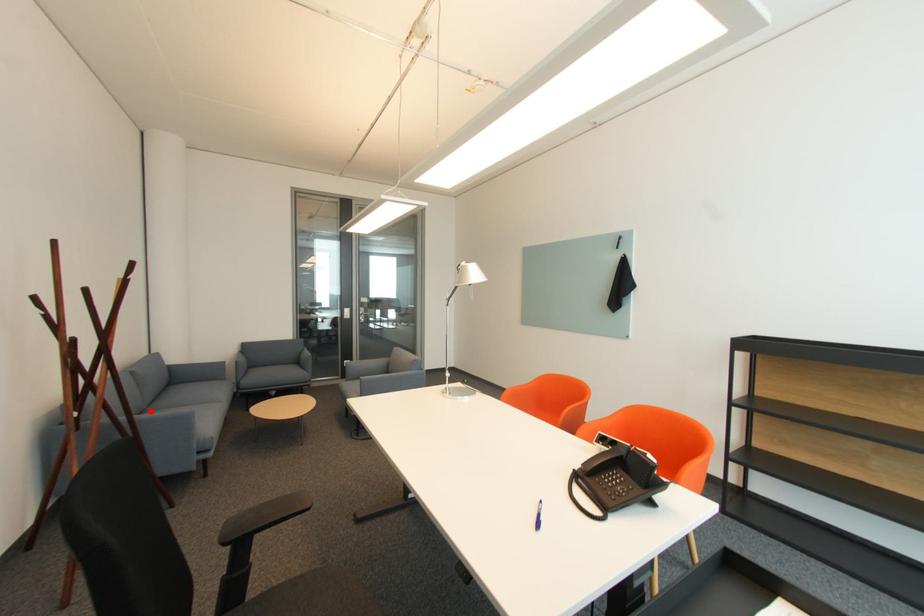
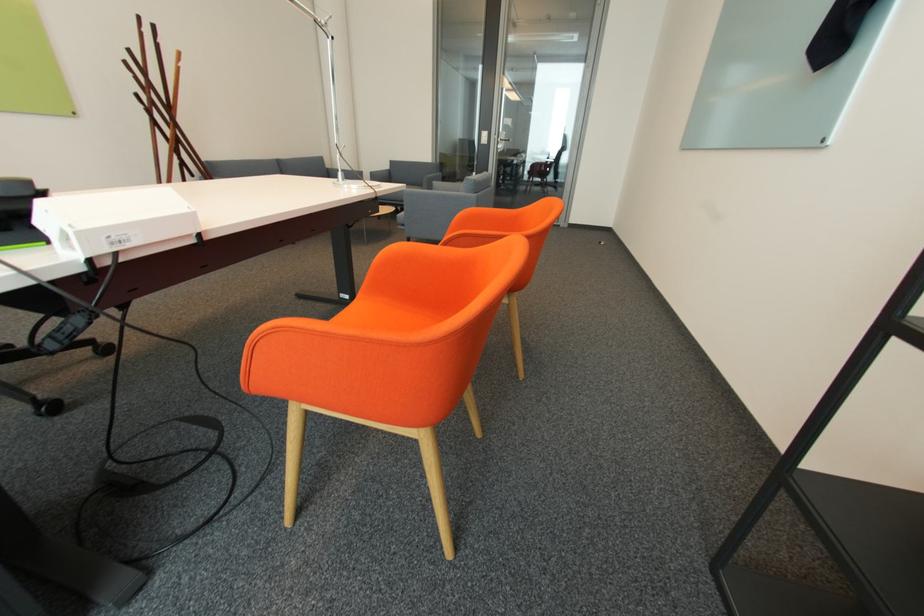
Question: I am providing you with two images of the same scene from different viewpoints. A red point is marked on the first image. Is the red point's position out of view in image 2?

Choices:
 (A) Yes
 (B) No

Answer: (A)